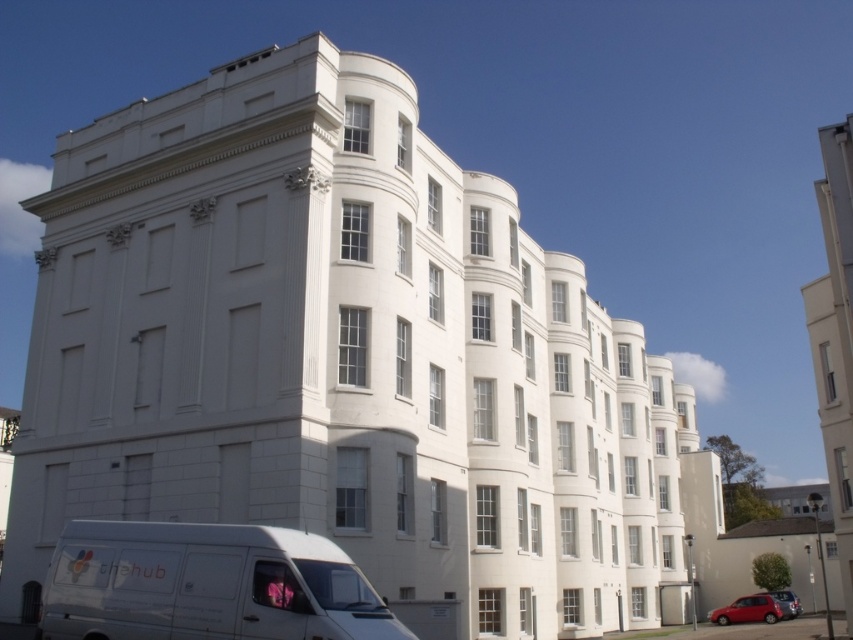
You are standing in front of the building and want to park your car. The parking spot is marked by the point at coordinates (206,584). Can you tell me where exactly this parking spot is located relative to the white van at lower left?

The point at coordinates (206,584) indicates the location of the white matte van at lower left, so the parking spot is exactly where the white matte van at lower left is currently parked.

You are a delivery person who needs to park your vehicle in a parking spot that can only accommodate vehicles up to the height of the shiny red car at lower right. Can your white matte van at lower left fit in this parking spot?

The white matte van at lower left is not as tall as shiny red car at lower right, so it can fit in the parking spot designed for vehicles up to the height of the shiny red car at lower right.

You are a delivery driver who needs to park your vehicle in the parking lot behind the large white building. You see a white matte van at lower left and a shiny red car at lower right. Which vehicle has more space requirements for parking?

The white matte van at lower left is bigger than the shiny red car at lower right, so it requires more space for parking.